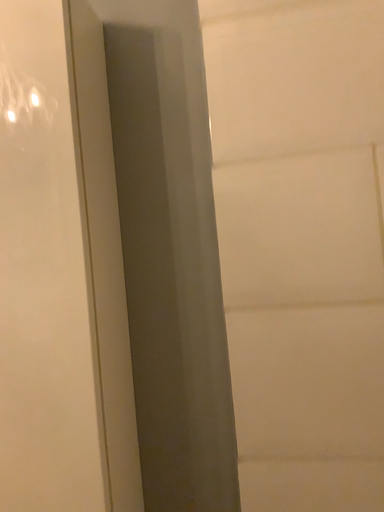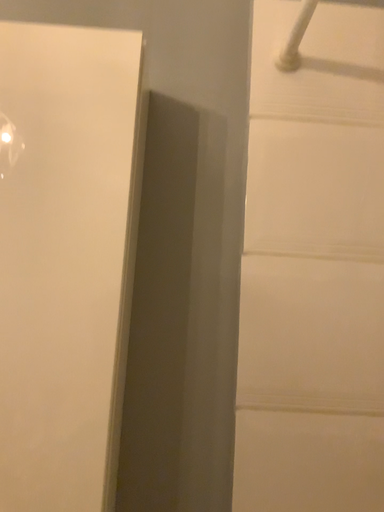
Question: Which way did the camera rotate in the video?

Choices:
 (A) rotated upward
 (B) rotated downward

Answer: (A)